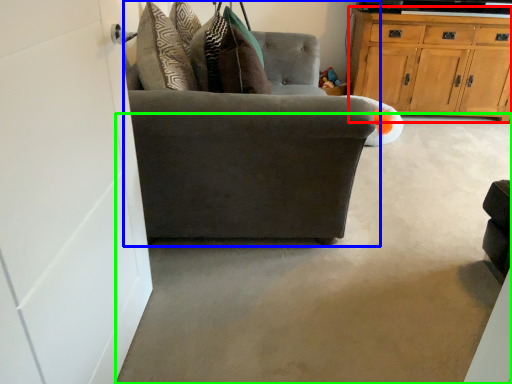
Question: Which object is the closest to the cabinetry (highlighted by a red box)? Choose among these: chair (highlighted by a blue box) or concrete (highlighted by a green box).

Choices:
 (A) chair
 (B) concrete

Answer: (B)